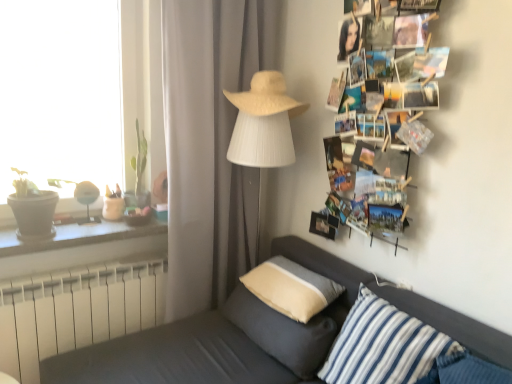
This screenshot has width=512, height=384. Describe the element at coordinates (76, 311) in the screenshot. I see `white plastic radiator at lower left` at that location.

The height and width of the screenshot is (384, 512). What do you see at coordinates (396, 82) in the screenshot?
I see `printed paper collage at upper right` at bounding box center [396, 82].

What do you see at coordinates (262, 141) in the screenshot? I see `white fabric lampshade at center` at bounding box center [262, 141].

This screenshot has width=512, height=384. Find the location of `blue striped fabric pillow at lower right, which is the 3th pillow in back-to-front order`. blue striped fabric pillow at lower right, which is the 3th pillow in back-to-front order is located at coordinates (383, 345).

Identify the location of white plastic radiator at lower left. This screenshot has height=384, width=512. (76, 311).

You are a GUI agent. You are given a task and a screenshot of the screen. Output one action in this format:
    pyautogui.click(x=<x>, y=<y>)
    Task: Click on the studio couch in front of the beige fabric pillow at center, acting as the 2th pillow starting from the front
    The height and width of the screenshot is (384, 512).
    Given the screenshot: What is the action you would take?
    pyautogui.click(x=259, y=336)

Which object is closer to the camera taking this photo, beige fabric pillow at center, placed as the second pillow when sorted from back to front, or dark gray fabric couch at lower left?

dark gray fabric couch at lower left is more forward.

Considering the relative sizes of beige fabric pillow at center, acting as the 2th pillow starting from the front, and dark gray fabric couch at lower left in the image provided, is beige fabric pillow at center, acting as the 2th pillow starting from the front, smaller than dark gray fabric couch at lower left?

Yes.

From the picture: Considering the positions of objects beige fabric pillow at center, acting as the 2th pillow starting from the front, and dark gray fabric couch at lower left in the image provided, who is more to the left, beige fabric pillow at center, acting as the 2th pillow starting from the front, or dark gray fabric couch at lower left?

Positioned to the left is dark gray fabric couch at lower left.

Considering the relative sizes of beige fabric pillow at center, placed as the second pillow when sorted from back to front, and blue striped fabric pillow at lower right, which is the 3th pillow in back-to-front order, in the image provided, is beige fabric pillow at center, placed as the second pillow when sorted from back to front, wider than blue striped fabric pillow at lower right, which is the 3th pillow in back-to-front order,?

Correct, the width of beige fabric pillow at center, placed as the second pillow when sorted from back to front, exceeds that of blue striped fabric pillow at lower right, which is the 3th pillow in back-to-front order.

Is beige fabric pillow at center, placed as the second pillow when sorted from back to front, further to the viewer compared to blue striped fabric pillow at lower right, the first pillow positioned from the front?

Yes, beige fabric pillow at center, placed as the second pillow when sorted from back to front, is further from the camera.

Between beige fabric pillow at center, placed as the second pillow when sorted from back to front, and blue striped fabric pillow at lower right, which is the 3th pillow in back-to-front order, which one appears on the left side from the viewer's perspective?

beige fabric pillow at center, placed as the second pillow when sorted from back to front, is more to the left.

Are beige fabric pillow at center, acting as the 2th pillow starting from the front, and blue striped fabric pillow at lower right, which is the 3th pillow in back-to-front order, far apart?

No, beige fabric pillow at center, acting as the 2th pillow starting from the front, is in close proximity to blue striped fabric pillow at lower right, which is the 3th pillow in back-to-front order.

How far apart are white woven hat at upper center and dark gray fabric couch at lower left?

They are 37.44 inches apart.

From a real-world perspective, is white woven hat at upper center beneath dark gray fabric couch at lower left?

Actually, white woven hat at upper center is physically above dark gray fabric couch at lower left in the real world.

From the image's perspective, is white woven hat at upper center located above dark gray fabric couch at lower left?

Yes, from the image's perspective, white woven hat at upper center is over dark gray fabric couch at lower left.

Considering the relative positions of white woven hat at upper center and dark gray fabric couch at lower left in the image provided, is white woven hat at upper center to the left of dark gray fabric couch at lower left from the viewer's perspective?

In fact, white woven hat at upper center is to the right of dark gray fabric couch at lower left.

Is printed paper collage at upper right in front of or behind white plastic radiator at lower left in the image?

Visually, printed paper collage at upper right is located in front of white plastic radiator at lower left.

From the image's perspective, is printed paper collage at upper right located beneath white plastic radiator at lower left?

Incorrect, from the image's perspective, printed paper collage at upper right is higher than white plastic radiator at lower left.

Is white plastic radiator at lower left completely or partially inside printed paper collage at upper right?

No, white plastic radiator at lower left is not surrounded by printed paper collage at upper right.

Which point is more forward, (x=328, y=100) or (x=103, y=285)?

The point (x=103, y=285) is closer to the camera.

Is gray fabric curtain at center not within white fabric lampshade at center?

Yes, gray fabric curtain at center is not within white fabric lampshade at center.

Between gray fabric curtain at center and white fabric lampshade at center, which one has larger width?

Wider between the two is white fabric lampshade at center.

From the image's perspective, does gray fabric curtain at center appear higher than white fabric lampshade at center?

Yes, from the image's perspective, gray fabric curtain at center is on top of white fabric lampshade at center.

Is gray fabric curtain at center facing away from white fabric lampshade at center?

Yes, gray fabric curtain at center is positioned with its back facing white fabric lampshade at center.

Can you tell me how much gray fabric curtain at center and beige fabric pillow at center, which ranks as the 3th pillow in front-to-back order, differ in facing direction?

A: 90.1 degrees.

Does point (193, 108) come farther from viewer compared to point (307, 309)?

Yes, it is behind point (307, 309).

You are a GUI agent. You are given a task and a screenshot of the screen. Output one action in this format:
    pyautogui.click(x=<x>, y=<y>)
    Task: Click on the 1st pillow located beneath the gray fabric curtain at center (from a real-world perspective)
    Image resolution: width=512 pixels, height=384 pixels.
    Given the screenshot: What is the action you would take?
    pyautogui.click(x=291, y=288)

Is gray fabric curtain at center further to camera compared to beige fabric pillow at center, which ranks as the 3th pillow in front-to-back order?

Yes, gray fabric curtain at center is further from the viewer.

Who is smaller, white woven hat at upper center or gray fabric curtain at center?

white woven hat at upper center is smaller.

Which object is positioned more to the left, white woven hat at upper center or gray fabric curtain at center?

gray fabric curtain at center is more to the left.

Does white woven hat at upper center turn towards gray fabric curtain at center?

No.

Is there a large distance between white woven hat at upper center and gray fabric curtain at center?

No, white woven hat at upper center is not far from gray fabric curtain at center.

Identify the location of studio couch in front of the beige fabric pillow at center, placed as the second pillow when sorted from back to front. The height and width of the screenshot is (384, 512). (259, 336).

Starting from the blue striped fabric pillow at lower right, which is the 3th pillow in back-to-front order, which pillow is the 2nd one to the left? Please provide its 2D coordinates.

[(281, 332)]

When comparing their distances from beige fabric pillow at center, which is the 1th pillow from back to front, does beige fabric pillow at center, placed as the second pillow when sorted from back to front, or dark gray concrete window sill at left seem further?

The object further to beige fabric pillow at center, which is the 1th pillow from back to front, is dark gray concrete window sill at left.

Looking at the image, which one is located closer to white plastic radiator at lower left, white woven hat at upper center or dark gray fabric couch at lower left?

Based on the image, dark gray fabric couch at lower left appears to be nearer to white plastic radiator at lower left.

Estimate the real-world distances between objects in this image. Which object is closer to printed paper collage at upper right, dark gray concrete window sill at left or blue striped fabric pillow at lower right, which is the 3th pillow in back-to-front order?

blue striped fabric pillow at lower right, which is the 3th pillow in back-to-front order, is positioned closer to the anchor printed paper collage at upper right.

When comparing their distances from dark gray fabric couch at lower left, does dark gray concrete window sill at left or white plastic radiator at lower left seem closer?

Based on the image, white plastic radiator at lower left appears to be nearer to dark gray fabric couch at lower left.

Looking at the image, which one is located closer to blue striped fabric pillow at lower right, the first pillow positioned from the front, printed paper collage at upper right or gray fabric curtain at center?

The object closer to blue striped fabric pillow at lower right, the first pillow positioned from the front, is printed paper collage at upper right.

Looking at the image, which one is located closer to gray fabric curtain at center, blue striped fabric pillow at lower right, the first pillow positioned from the front, or dark gray concrete window sill at left?

The object closer to gray fabric curtain at center is dark gray concrete window sill at left.

Based on their spatial positions, is printed paper collage at upper right or white plastic radiator at lower left closer to white fabric lampshade at center?

printed paper collage at upper right lies closer to white fabric lampshade at center than the other object.

Looking at the image, which one is located closer to beige fabric pillow at center, placed as the second pillow when sorted from back to front, white woven hat at upper center or beige fabric pillow at center, which is the 1th pillow from back to front?

Based on the image, beige fabric pillow at center, which is the 1th pillow from back to front, appears to be nearer to beige fabric pillow at center, placed as the second pillow when sorted from back to front.

This screenshot has height=384, width=512. In order to click on curtain between printed paper collage at upper right and blue striped fabric pillow at lower right, the first pillow positioned from the front, in the up-down direction in this screenshot , I will do `click(210, 144)`.

You are a GUI agent. You are given a task and a screenshot of the screen. Output one action in this format:
    pyautogui.click(x=<x>, y=<y>)
    Task: Click on the studio couch located between dark gray concrete window sill at left and printed paper collage at upper right in the left-right direction
    The image size is (512, 384).
    Given the screenshot: What is the action you would take?
    pyautogui.click(x=259, y=336)

I want to click on studio couch situated between dark gray concrete window sill at left and white fabric lampshade at center from left to right, so click(259, 336).

Identify the location of table lamp located between white plastic radiator at lower left and blue striped fabric pillow at lower right, which is the 3th pillow in back-to-front order, in the left-right direction. This screenshot has width=512, height=384. (262, 141).